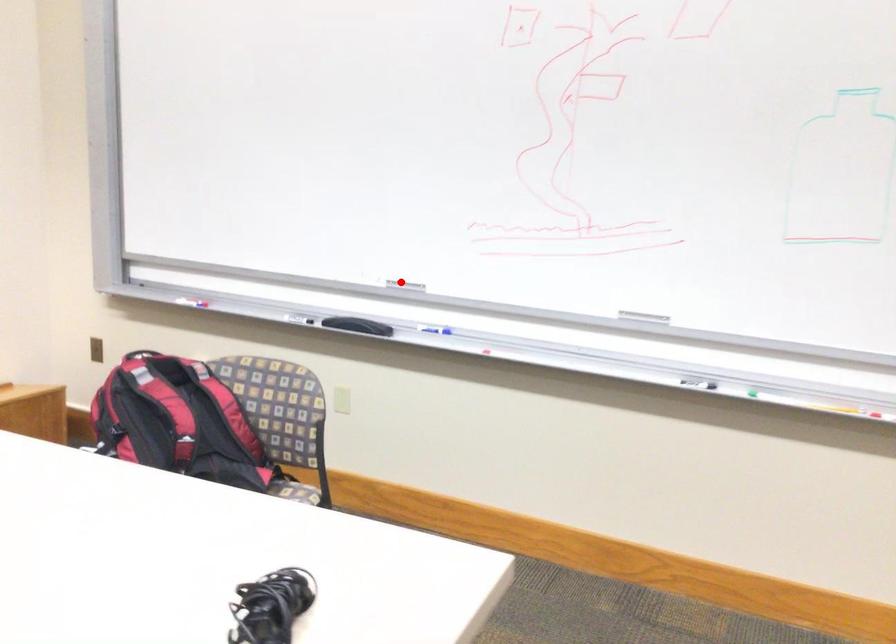
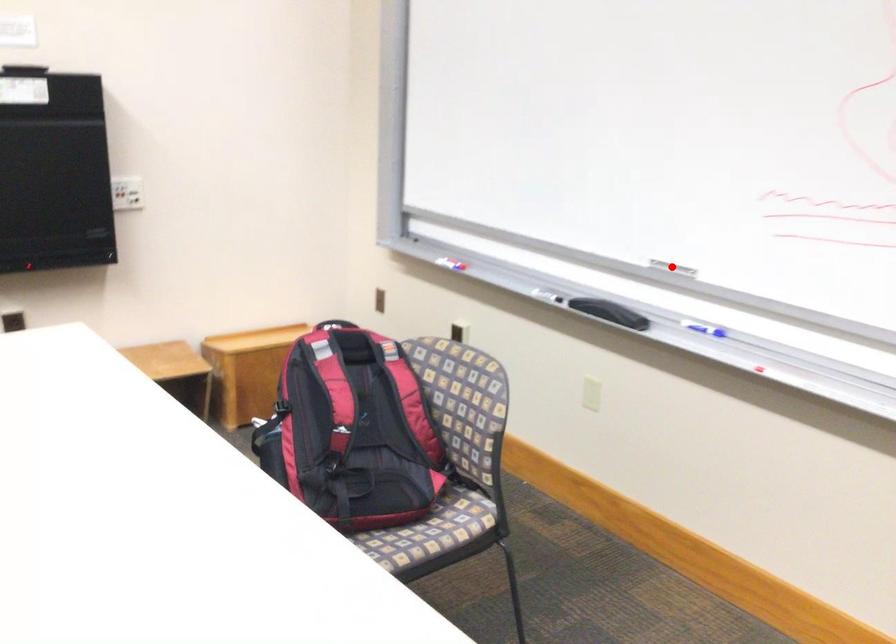
I am providing you with two images of the same scene from different viewpoints. A red point is marked on the first image and another point is marked on the second image. Is the red point in image1 aligned with the point shown in image2?

Yes